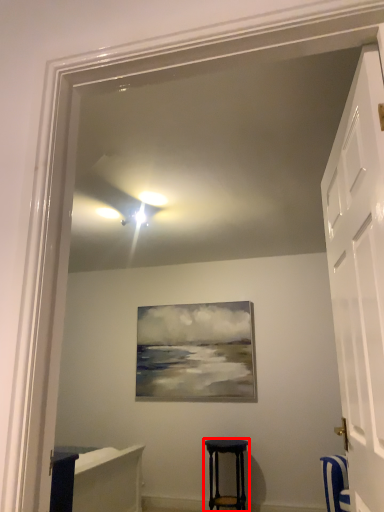
Question: In this image, where is stool (annotated by the red box) located relative to door?

Choices:
 (A) left
 (B) right

Answer: (A)